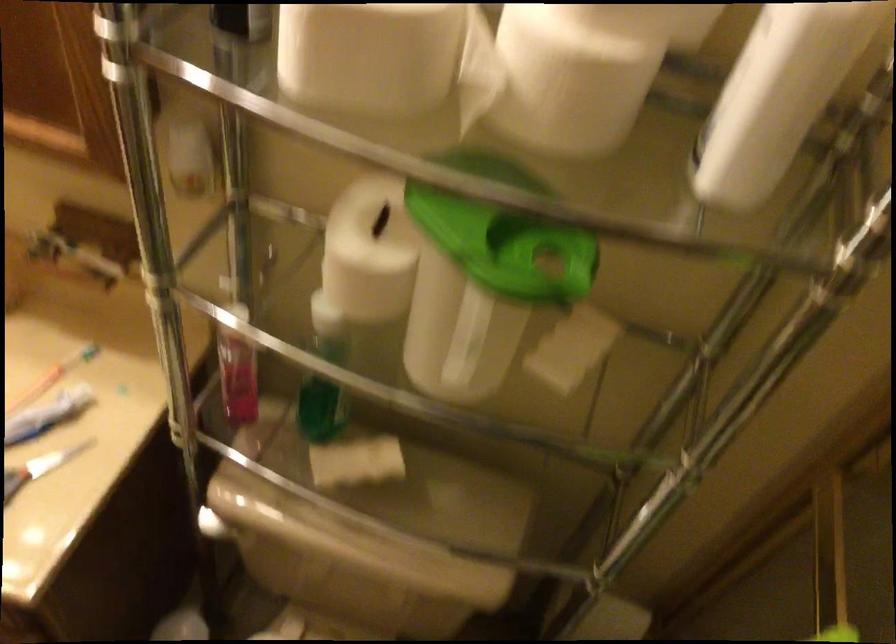
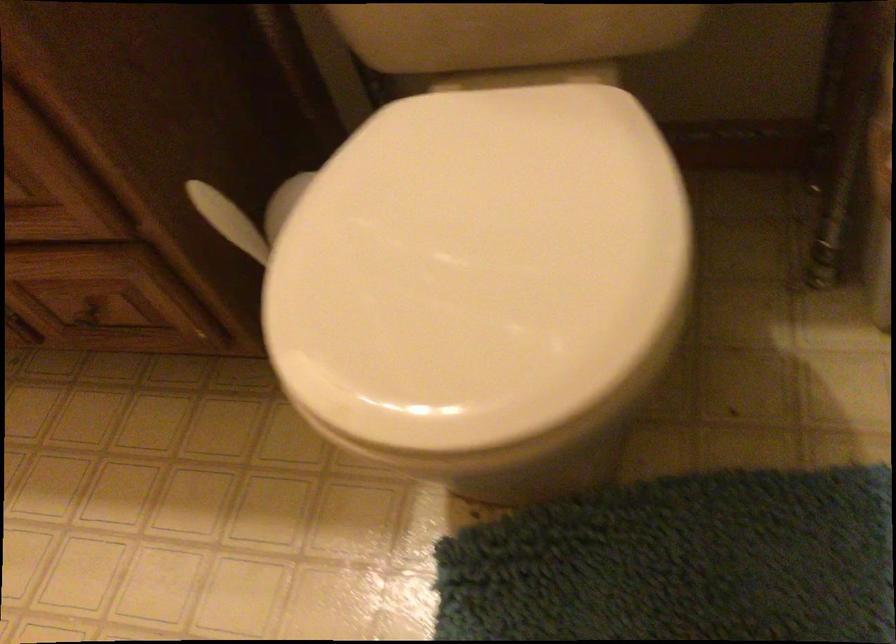
Question: Which direction would the cameraman need to move to produce the second image? Reply with the corresponding letter.

Choices:
 (A) Left
 (B) Right
 (C) Forward
 (D) Backward

Answer: (C)